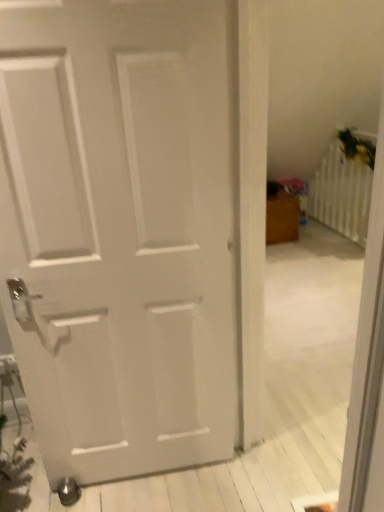
Question: Is white plastic radiator at upper right not near white matte door at center?

Choices:
 (A) yes
 (B) no

Answer: (A)

Question: From the image's perspective, is white plastic radiator at upper right on white matte door at center?

Choices:
 (A) no
 (B) yes

Answer: (B)

Question: Considering the relative sizes of white plastic radiator at upper right and white matte door at center in the image provided, is white plastic radiator at upper right smaller than white matte door at center?

Choices:
 (A) no
 (B) yes

Answer: (B)

Question: From the image's perspective, is white plastic radiator at upper right beneath white matte door at center?

Choices:
 (A) yes
 (B) no

Answer: (B)

Question: From a real-world perspective, is white plastic radiator at upper right located higher than white matte door at center?

Choices:
 (A) no
 (B) yes

Answer: (A)

Question: Can you confirm if white plastic radiator at upper right is shorter than white matte door at center?

Choices:
 (A) yes
 (B) no

Answer: (A)

Question: Is white matte door at center next to white plastic radiator at upper right?

Choices:
 (A) no
 (B) yes

Answer: (A)

Question: From the image's perspective, is white matte door at center above white plastic radiator at upper right?

Choices:
 (A) no
 (B) yes

Answer: (A)

Question: From the image's perspective, is white matte door at center located beneath white plastic radiator at upper right?

Choices:
 (A) no
 (B) yes

Answer: (B)

Question: Considering the relative sizes of white matte door at center and white plastic radiator at upper right in the image provided, is white matte door at center wider than white plastic radiator at upper right?

Choices:
 (A) yes
 (B) no

Answer: (A)

Question: Considering the relative sizes of white matte door at center and white plastic radiator at upper right in the image provided, is white matte door at center bigger than white plastic radiator at upper right?

Choices:
 (A) yes
 (B) no

Answer: (A)

Question: Is white matte door at center further to the viewer compared to white plastic radiator at upper right?

Choices:
 (A) no
 (B) yes

Answer: (A)

Question: Which is correct: white matte door at center is inside white plastic radiator at upper right, or outside of it?

Choices:
 (A) outside
 (B) inside

Answer: (A)